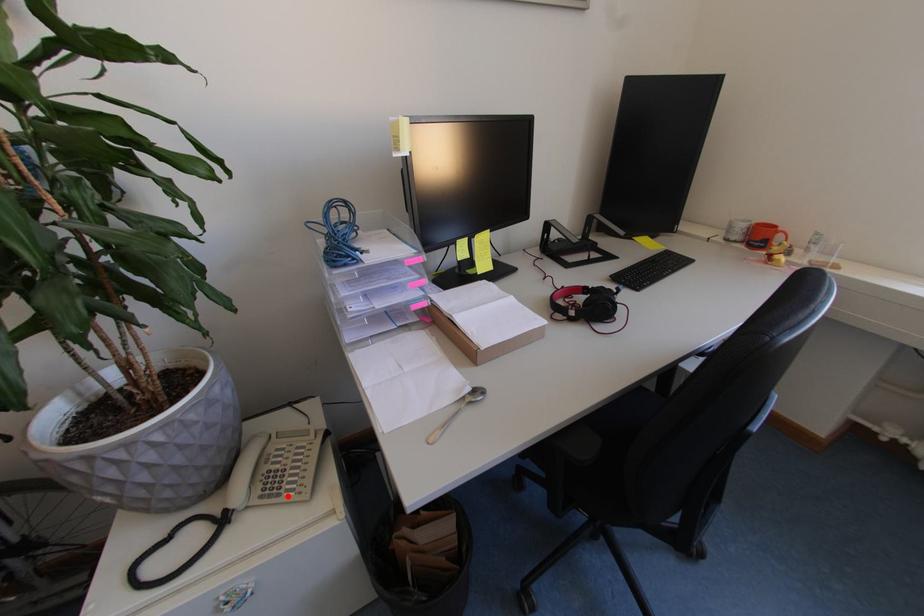
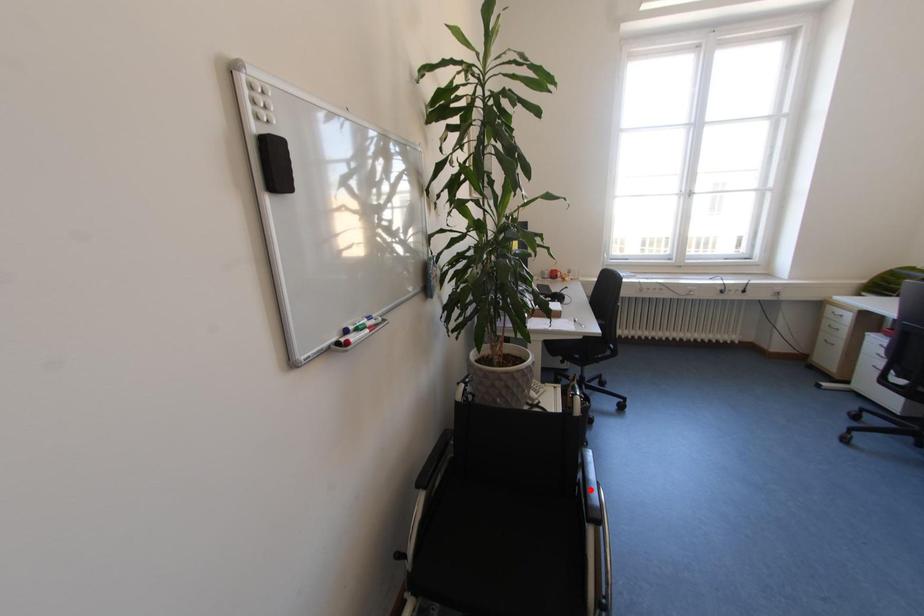
I am providing you with two images of the same scene from different viewpoints. A red point is marked on the first image and another point is marked on the second image. Are the points marked in image1 and image2 representing the same 3D position?

No